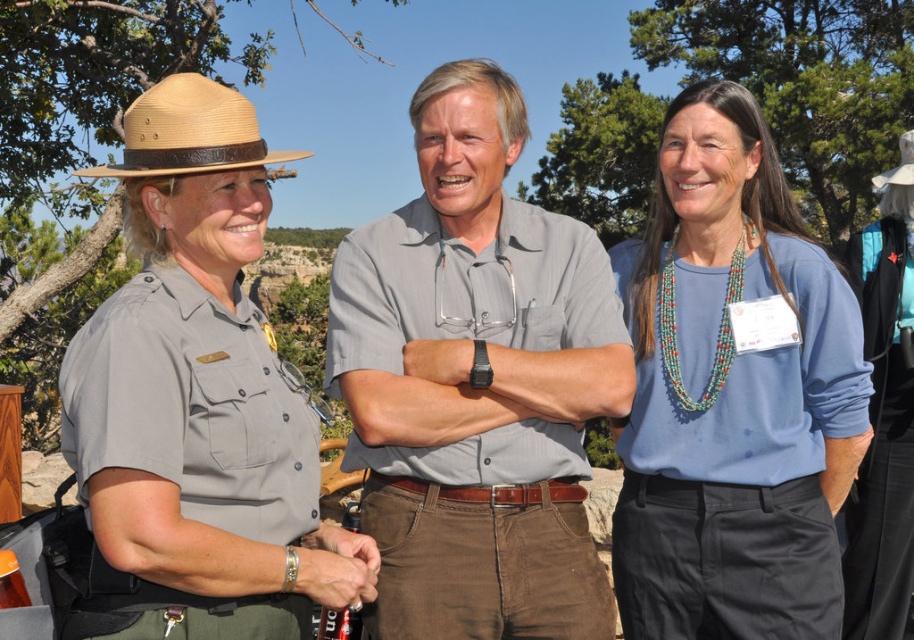
Is point (145, 566) farther from viewer compared to point (898, 182)?

No, (145, 566) is in front of (898, 182).

Does matte gray uniform at center appear on the right side of straw hat at center?

Incorrect, matte gray uniform at center is not on the right side of straw hat at center.

Which is in front, point (172, 515) or point (891, 180)?

Positioned in front is point (172, 515).

The width and height of the screenshot is (914, 640). I want to click on matte gray uniform at center, so click(x=193, y=381).

Does gray cotton shirt at center have a smaller size compared to blue matte shirt at center?

Indeed, gray cotton shirt at center has a smaller size compared to blue matte shirt at center.

Is gray cotton shirt at center below blue matte shirt at center?

No.

At what (x,y) coordinates should I click in order to perform the action: click on gray cotton shirt at center. Please return your answer as a coordinate pair (x, y). The height and width of the screenshot is (640, 914). Looking at the image, I should click on pos(477,384).

Is natural straw cowboy hat at upper left shorter than matte gray watch at center?

In fact, natural straw cowboy hat at upper left may be taller than matte gray watch at center.

Is natural straw cowboy hat at upper left to the right of matte gray watch at center from the viewer's perspective?

No, natural straw cowboy hat at upper left is not to the right of matte gray watch at center.

Which is in front, point (209, 131) or point (445, 385)?

Positioned in front is point (209, 131).

Where is `natural straw cowboy hat at upper left`? natural straw cowboy hat at upper left is located at coordinates (189, 131).